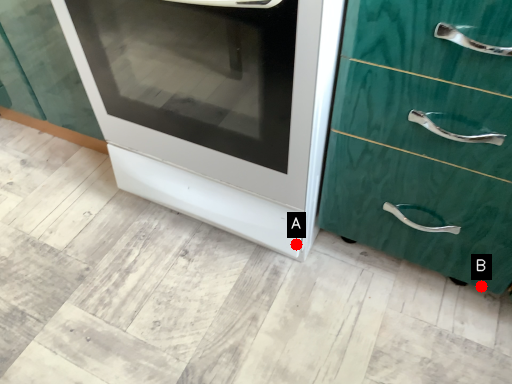
Question: Two points are circled on the image, labeled by A and B beside each circle. Which point is further to the camera?

Choices:
 (A) A is further
 (B) B is further

Answer: (A)